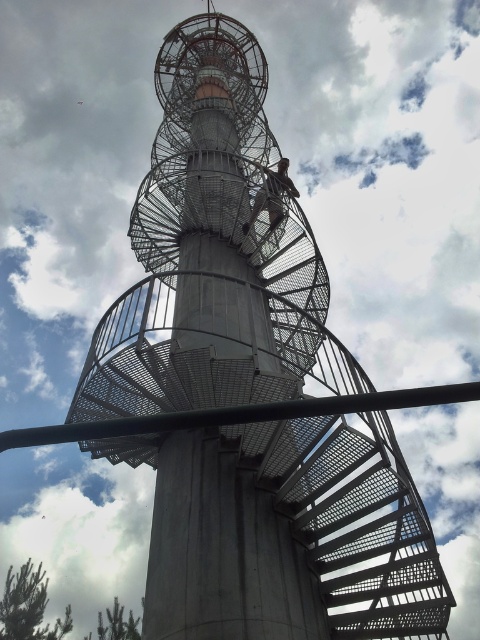
Question: Can you confirm if concrete staircase at center is positioned to the left of metallic climbing harness at center?

Choices:
 (A) yes
 (B) no

Answer: (A)

Question: Which of the following is the farthest from the observer?

Choices:
 (A) concrete staircase at center
 (B) metallic climbing harness at center

Answer: (B)

Question: Can you confirm if concrete staircase at center is smaller than metallic climbing harness at center?

Choices:
 (A) yes
 (B) no

Answer: (B)

Question: Does concrete staircase at center appear on the left side of metallic climbing harness at center?

Choices:
 (A) yes
 (B) no

Answer: (A)